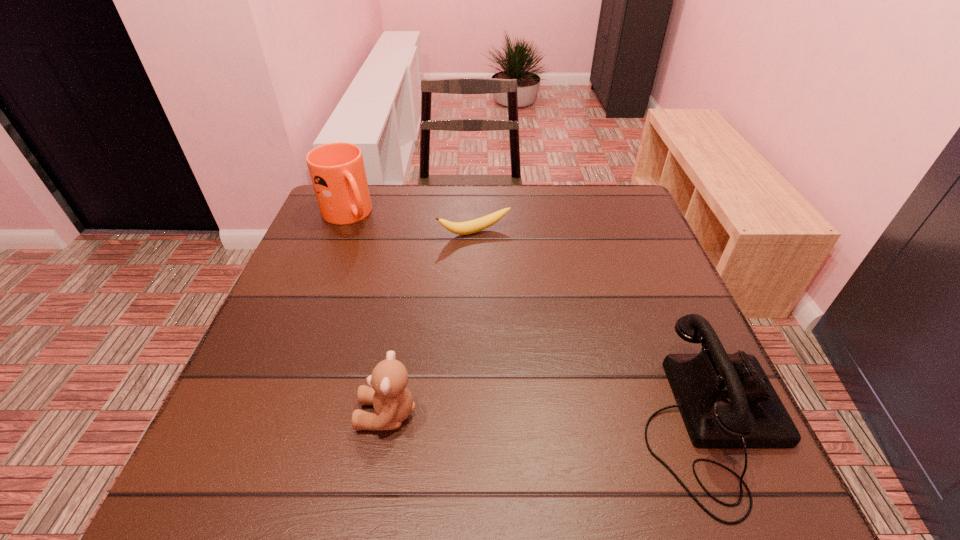
Identify the location of blank space located 0.150m on the upward curve of the shortest object. This screenshot has height=540, width=960. (510, 276).

The width and height of the screenshot is (960, 540). Identify the location of free space located 0.240m on the upward curve of the shortest object. (526, 301).

At what (x,y) coordinates should I click in order to perform the action: click on vacant area situated on the handle side of the mug. Please return your answer as a coordinate pair (x, y). Looking at the image, I should click on (430, 303).

Locate an element on the screen. This screenshot has width=960, height=540. free location located 0.280m on the handle side of the mug is located at coordinates (413, 286).

What are the coordinates of `free space located on the handle side of the mug` in the screenshot? It's located at (394, 266).

Where is `banana located at the far edge`? This screenshot has height=540, width=960. banana located at the far edge is located at coordinates (469, 227).

Locate an element on the screen. mug that is at the far edge is located at coordinates (337, 171).

Locate an element on the screen. teddy bear at the near edge is located at coordinates (392, 401).

Where is `telephone that is at the near edge`? This screenshot has width=960, height=540. telephone that is at the near edge is located at coordinates (726, 400).

Find the location of `object present at the left edge`. object present at the left edge is located at coordinates (337, 171).